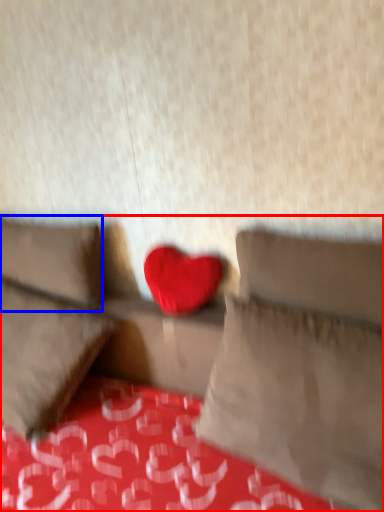
Question: Which object appears closest to the camera in this image, studio couch (highlighted by a red box) or pillow (highlighted by a blue box)?

Choices:
 (A) studio couch
 (B) pillow

Answer: (A)